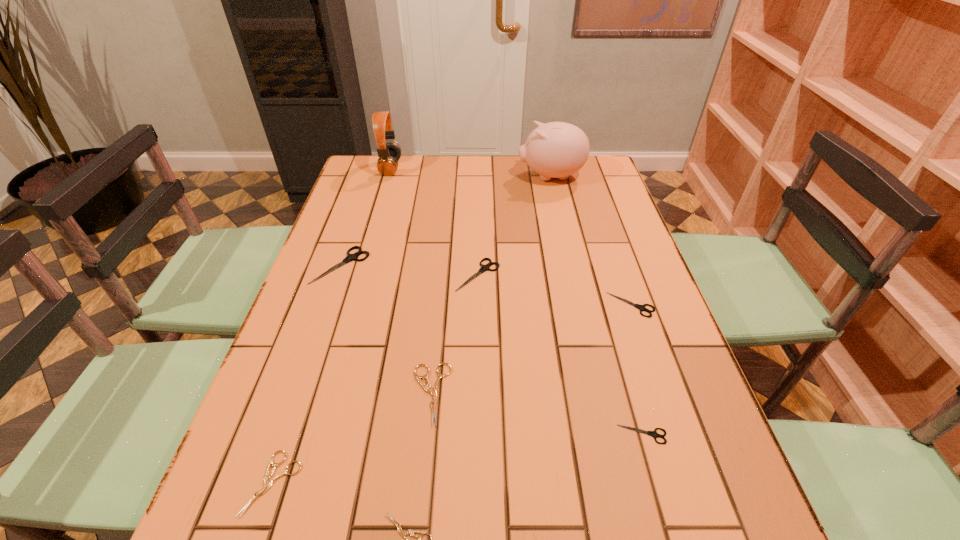
Identify the location of vacant area situated on the front of the smallest black shears. The height and width of the screenshot is (540, 960). (663, 507).

The image size is (960, 540). In order to click on headset located at the far edge in this screenshot , I will do `click(390, 153)`.

At what (x,y) coordinates should I click in order to perform the action: click on piggy bank present at the far edge. Please return your answer as a coordinate pair (x, y). Image resolution: width=960 pixels, height=540 pixels. Looking at the image, I should click on (556, 149).

Find the location of `headset that is positioned at the left edge`. headset that is positioned at the left edge is located at coordinates (390, 153).

Find the location of a particular element. Image resolution: width=960 pixels, height=540 pixels. piggy bank present at the right edge is located at coordinates (556, 149).

Where is `object located in the far left corner section of the desktop`? Image resolution: width=960 pixels, height=540 pixels. object located in the far left corner section of the desktop is located at coordinates (x=390, y=153).

Locate an element on the screen. The width and height of the screenshot is (960, 540). object that is at the far right corner is located at coordinates (556, 149).

In the image, there is a desktop. At what (x,y) coordinates should I click in order to perform the action: click on vacant space at the far edge. Please return your answer as a coordinate pair (x, y). The image size is (960, 540). Looking at the image, I should click on (427, 177).

Where is `vacant region at the left edge of the desktop`? The height and width of the screenshot is (540, 960). vacant region at the left edge of the desktop is located at coordinates (332, 227).

Find the location of `vacant space at the right edge`. vacant space at the right edge is located at coordinates 600,263.